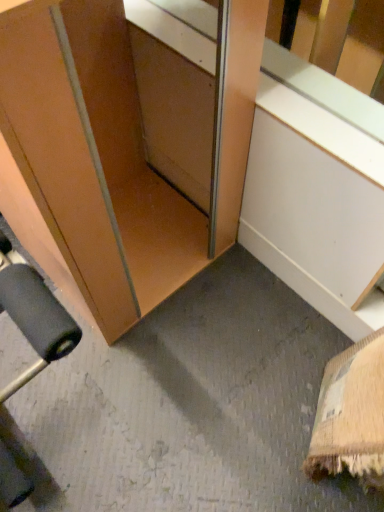
The height and width of the screenshot is (512, 384). Identify the location of matte wood cabinet at lower left. (119, 153).

Describe the element at coordinates (119, 153) in the screenshot. I see `matte wood cabinet at lower left` at that location.

Where is `wooden at lower left`? wooden at lower left is located at coordinates (324, 111).

The width and height of the screenshot is (384, 512). Describe the element at coordinates (324, 111) in the screenshot. I see `wooden at lower left` at that location.

Find the location of a particular element. This screenshot has height=512, width=384. matte wood cabinet at lower left is located at coordinates pos(119,153).

Is matte wood cabinet at lower left at the right side of wooden at lower left?

In fact, matte wood cabinet at lower left is to the left of wooden at lower left.

Is matte wood cabinet at lower left in front of or behind wooden at lower left in the image?

matte wood cabinet at lower left is positioned closer to the viewer than wooden at lower left.

Does point (216, 197) lie behind point (129, 13)?

Yes.

From the image's perspective, is matte wood cabinet at lower left positioned above or below wooden at lower left?

Based on their image positions, matte wood cabinet at lower left is located above wooden at lower left.

Consider the image. From a real-world perspective, is matte wood cabinet at lower left positioned above or below wooden at lower left?

From a real-world perspective, matte wood cabinet at lower left is physically above wooden at lower left.

Can you confirm if matte wood cabinet at lower left is thinner than wooden at lower left?

No, matte wood cabinet at lower left is not thinner than wooden at lower left.

In the scene shown: In terms of height, does matte wood cabinet at lower left look taller or shorter compared to wooden at lower left?

Considering their sizes, matte wood cabinet at lower left has more height than wooden at lower left.

Which of these two, matte wood cabinet at lower left or wooden at lower left, is bigger?

matte wood cabinet at lower left is bigger.

Is matte wood cabinet at lower left completely or partially outside of wooden at lower left?

Yes, matte wood cabinet at lower left is not within wooden at lower left.

Would you consider matte wood cabinet at lower left to be distant from wooden at lower left?

They are positioned close to each other.

Is matte wood cabinet at lower left facing away from wooden at lower left?

Absolutely, matte wood cabinet at lower left is directed away from wooden at lower left.

Can you tell me how much matte wood cabinet at lower left and wooden at lower left differ in facing direction?

There is a 0.842-degree angle between the facing directions of matte wood cabinet at lower left and wooden at lower left.

Where is `cabinetry that is above the wooden at lower left (from the image's perspective)`? This screenshot has width=384, height=512. cabinetry that is above the wooden at lower left (from the image's perspective) is located at coordinates click(x=119, y=153).

Visually, is wooden at lower left positioned to the left or to the right of matte wood cabinet at lower left?

From the image, it's evident that wooden at lower left is to the right of matte wood cabinet at lower left.

Is the depth of wooden at lower left greater than that of matte wood cabinet at lower left?

Yes, it is behind matte wood cabinet at lower left.

Is point (273, 84) behind point (151, 282)?

No, (273, 84) is in front of (151, 282).

From the image's perspective, would you say wooden at lower left is positioned over matte wood cabinet at lower left?

No, from the image's perspective, wooden at lower left is not above matte wood cabinet at lower left.

From a real-world perspective, who is located higher, wooden at lower left or matte wood cabinet at lower left?

matte wood cabinet at lower left is physically above.

Based on the photo, considering the sizes of objects wooden at lower left and matte wood cabinet at lower left in the image provided, who is thinner, wooden at lower left or matte wood cabinet at lower left?

Result: wooden at lower left is thinner.

From their relative heights in the image, would you say wooden at lower left is taller or shorter than matte wood cabinet at lower left?

Considering their sizes, wooden at lower left has less height than matte wood cabinet at lower left.

Does wooden at lower left have a smaller size compared to matte wood cabinet at lower left?

Yes, wooden at lower left is smaller than matte wood cabinet at lower left.

Is matte wood cabinet at lower left completely or partially inside wooden at lower left?

That's incorrect, matte wood cabinet at lower left is not inside wooden at lower left.

From the picture: Is wooden at lower left placed right next to matte wood cabinet at lower left?

wooden at lower left and matte wood cabinet at lower left are not in contact.

Looking at this image, is wooden at lower left aimed at matte wood cabinet at lower left?

Yes.

Can you tell me how much wooden at lower left and matte wood cabinet at lower left differ in facing direction?

The angular difference between wooden at lower left and matte wood cabinet at lower left is 0.842 degrees.

Measure the distance between wooden at lower left and matte wood cabinet at lower left.

wooden at lower left is 12.09 inches away from matte wood cabinet at lower left.

The height and width of the screenshot is (512, 384). In order to click on window sill on the right of matte wood cabinet at lower left in this screenshot , I will do `click(324, 111)`.

Where is `cabinetry above the wooden at lower left (from the image's perspective)`? The height and width of the screenshot is (512, 384). cabinetry above the wooden at lower left (from the image's perspective) is located at coordinates (119, 153).

The image size is (384, 512). Identify the location of window sill below the matte wood cabinet at lower left (from the image's perspective). (324, 111).